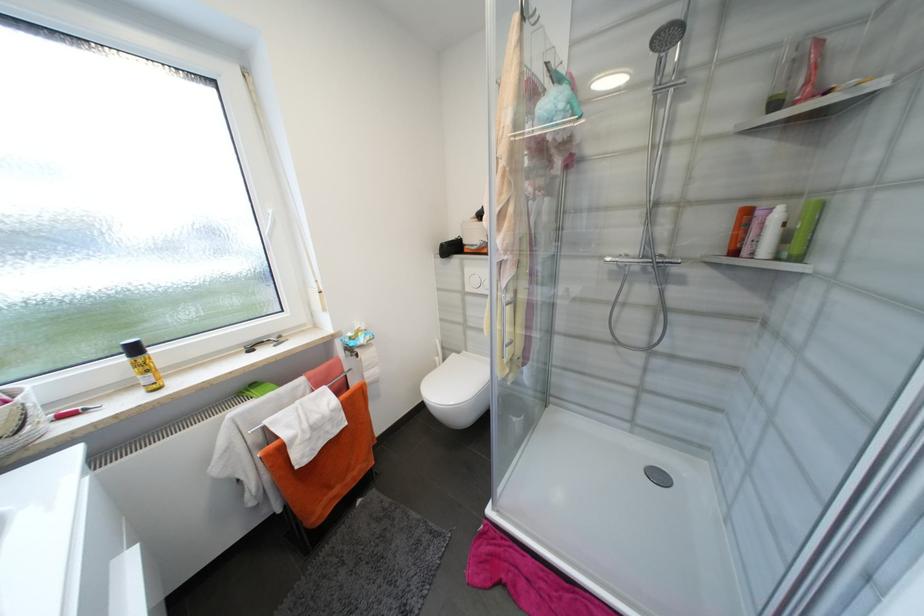
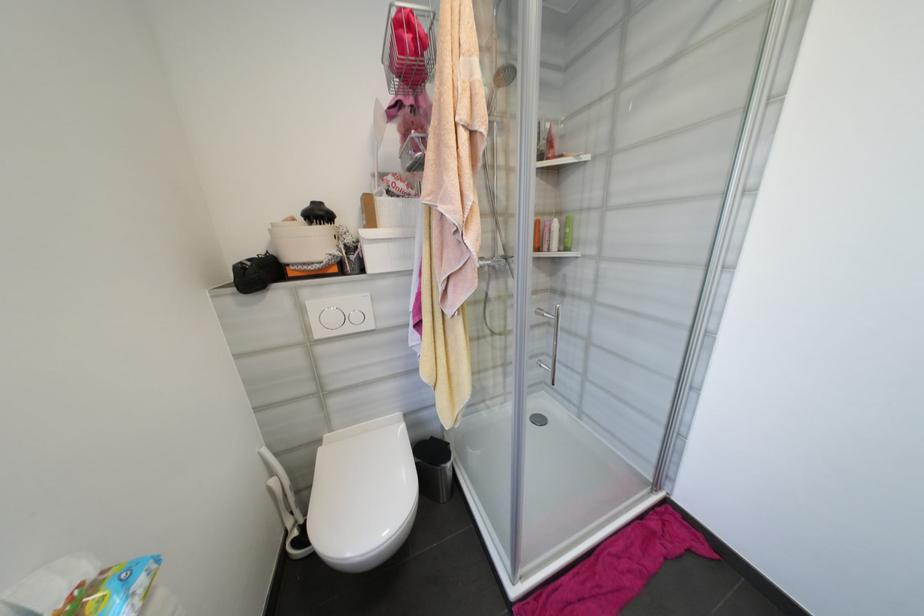
Locate, in the second image, the point that corresponds to (751,253) in the first image.

(551, 249)